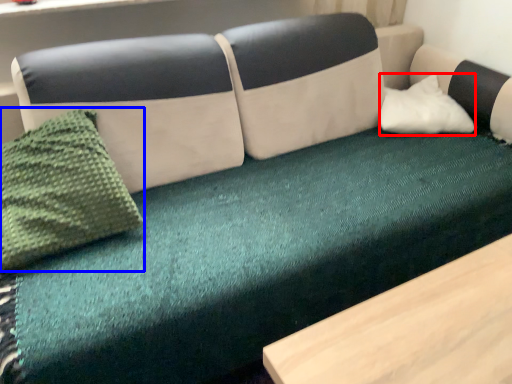
Question: Which of the following is the closest to the observer, pillow (highlighted by a red box) or throw pillow (highlighted by a blue box)?

Choices:
 (A) pillow
 (B) throw pillow

Answer: (B)